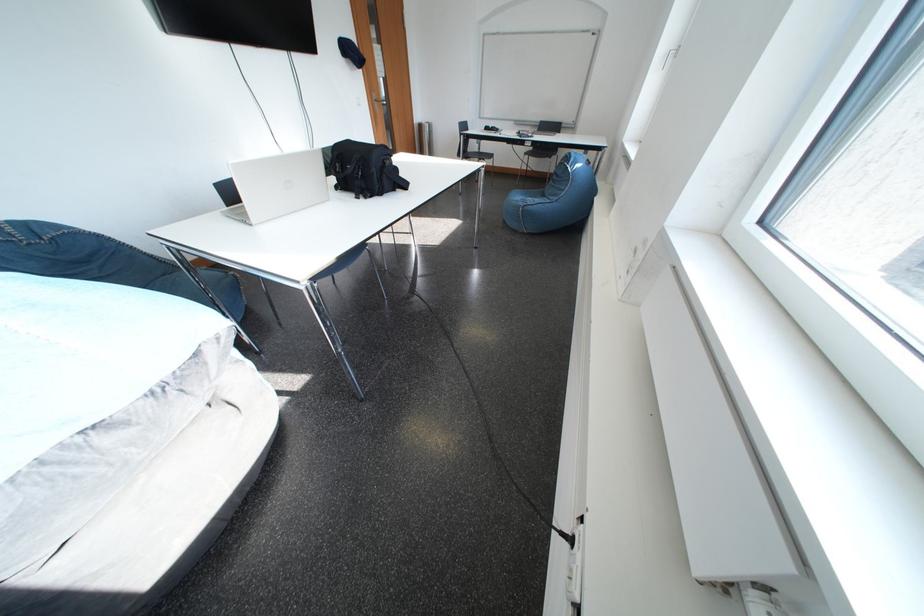
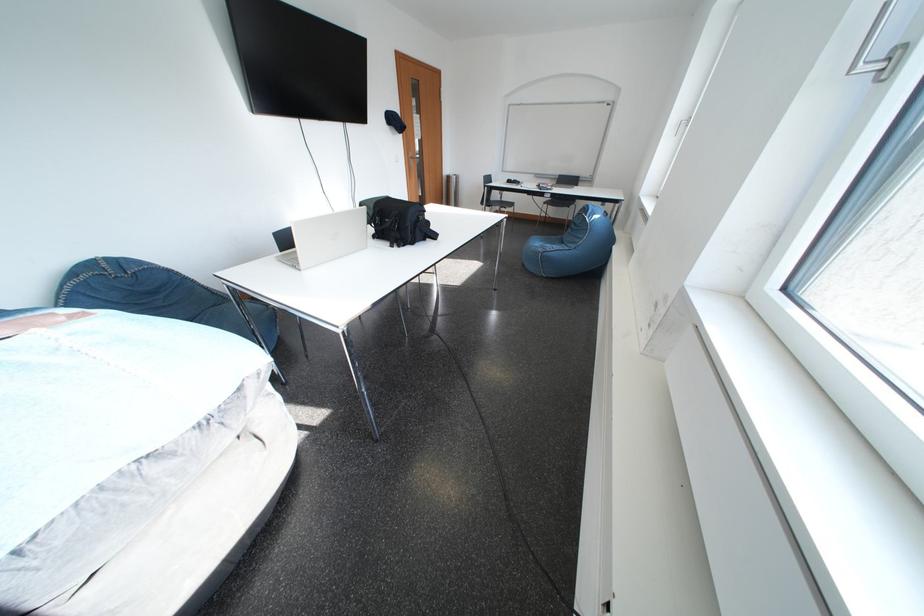
The images are taken continuously from a first-person perspective. In which direction are you moving?

The cameraman moved toward left, backward.